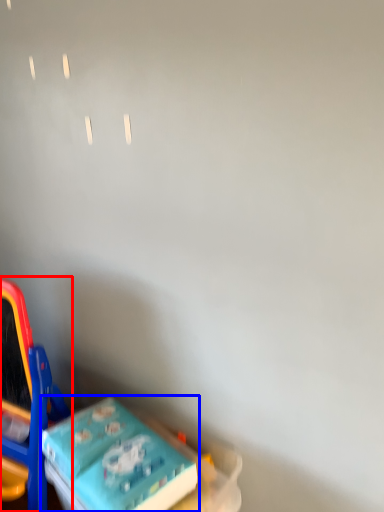
Question: Which object is closer to the camera taking this photo, toy (highlighted by a red box) or toy (highlighted by a blue box)?

Choices:
 (A) toy
 (B) toy

Answer: (B)